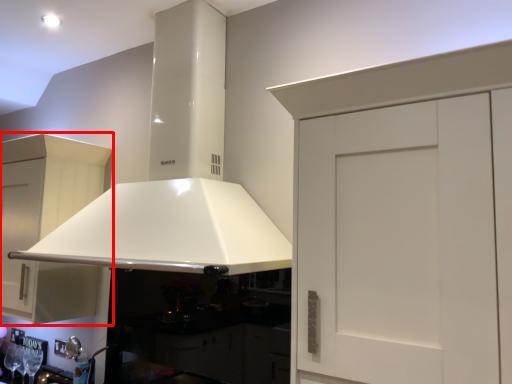
Question: From the image's perspective, what is the correct spatial positioning of cabinetry (annotated by the red box) in reference to exhaust hood?

Choices:
 (A) above
 (B) below

Answer: (B)